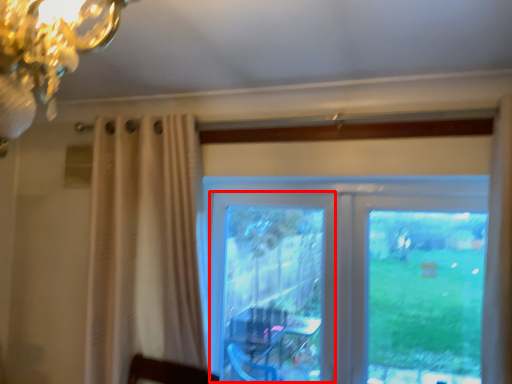
Question: From the image's perspective, where is screen door (annotated by the red box) located in relation to window in the image?

Choices:
 (A) below
 (B) above

Answer: (A)